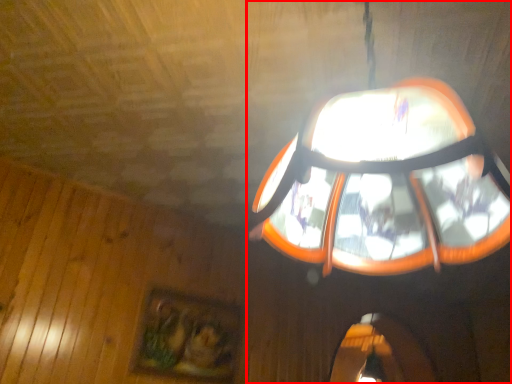
Question: From the image, what is the correct spatial relationship of lamp (annotated by the red box) in relation to picture frame?

Choices:
 (A) right
 (B) left

Answer: (A)